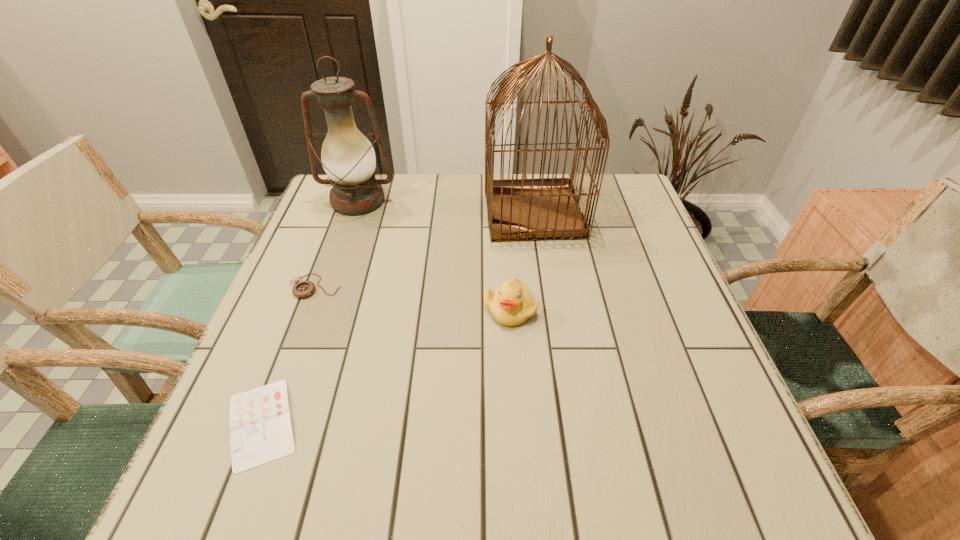
This screenshot has height=540, width=960. In order to click on birdcage in this screenshot , I will do `click(523, 209)`.

Identify the location of the second tallest object. The height and width of the screenshot is (540, 960). (347, 156).

Locate an element on the screen. Image resolution: width=960 pixels, height=540 pixels. the third tallest object is located at coordinates (510, 305).

Find the location of a particular element. Image resolution: width=960 pixels, height=540 pixels. pocket watch is located at coordinates (302, 289).

The width and height of the screenshot is (960, 540). I want to click on diary, so click(x=261, y=432).

The width and height of the screenshot is (960, 540). Identify the location of the nearest object. (261, 432).

Locate an element on the screen. vacant space situated 0.300m on the front of the birdcage is located at coordinates (552, 336).

Identify the location of vacant position located on the right of the fourth shortest object. The height and width of the screenshot is (540, 960). (424, 201).

Locate an element on the screen. This screenshot has height=540, width=960. vacant area located 0.280m at the face of the third tallest object is located at coordinates (520, 462).

Identify the location of free space located on the front of the second shortest object. This screenshot has height=540, width=960. (300, 327).